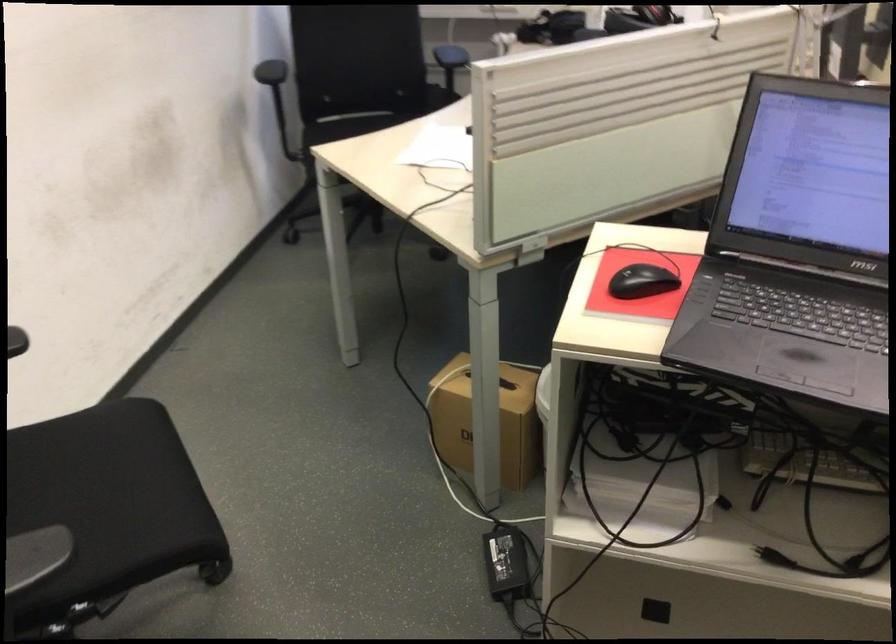
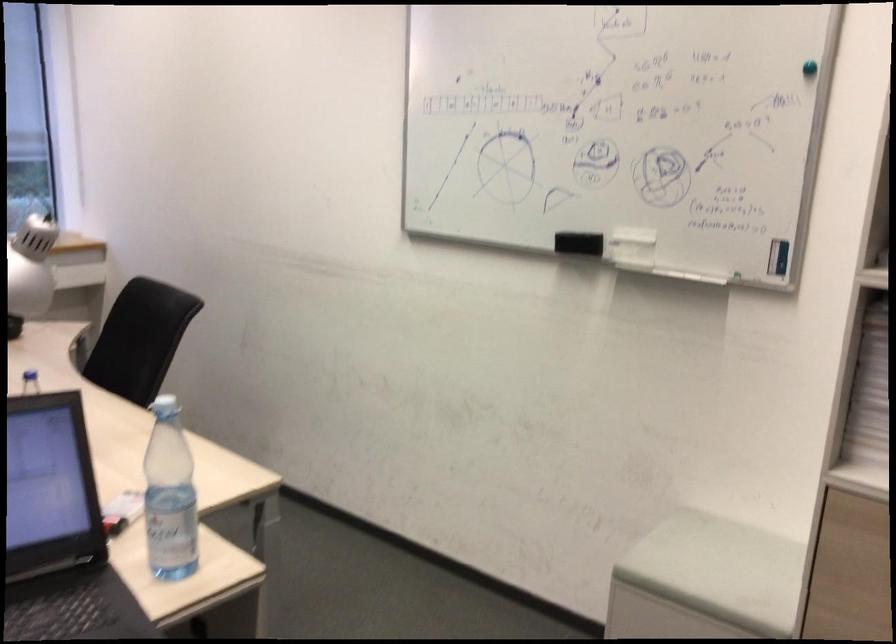
Question: The camera is either moving clockwise (left) or counter-clockwise (right) around the object. The first image is from the beginning of the video and the second image is from the end. Is the camera moving left or right when shooting the video?

Choices:
 (A) Left
 (B) Right

Answer: (A)